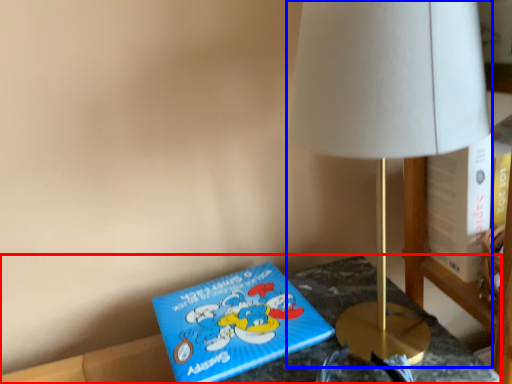
Question: Among these objects, which one is nearest to the camera, furniture (highlighted by a red box) or lamp (highlighted by a blue box)?

Choices:
 (A) furniture
 (B) lamp

Answer: (B)